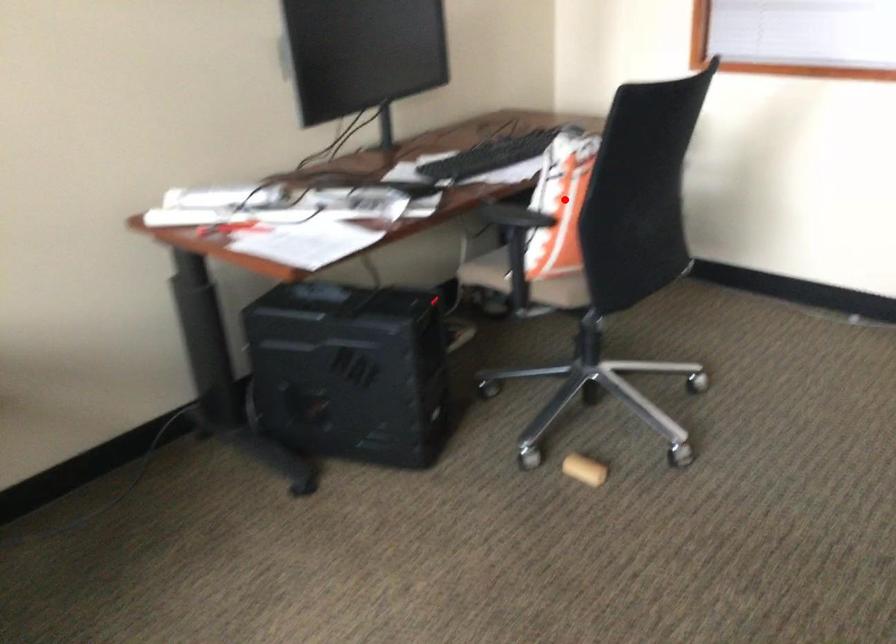
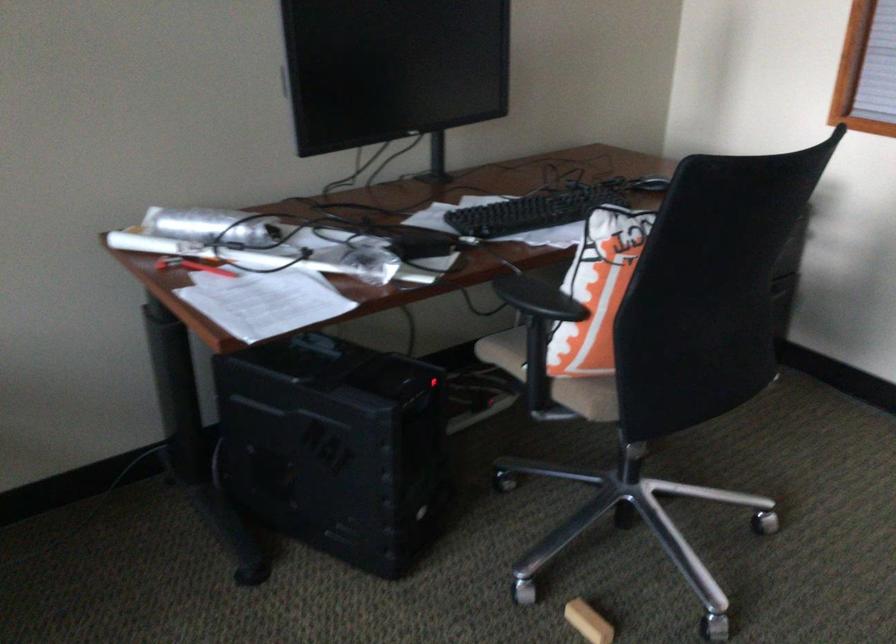
Where in the second image is the point corresponding to the highlighted location from the first image?

(597, 290)